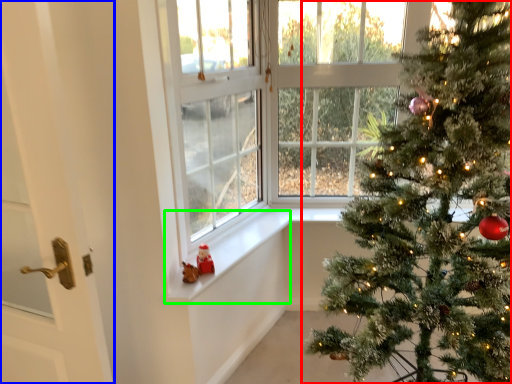
Question: Considering the real-world distances, which object is closest to christmas tree (highlighted by a red box)? door (highlighted by a blue box) or window sill (highlighted by a green box).

Choices:
 (A) door
 (B) window sill

Answer: (B)